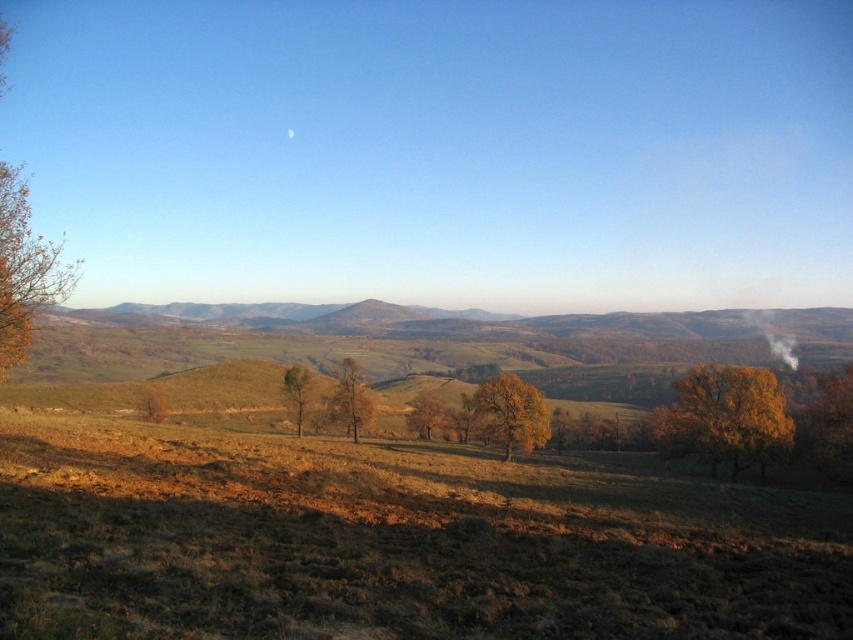
You are a farmer planning to plant crops in the brown grassland at center and the brown matte tree at center. Which area would require more space for planting, and why?

The brown grassland at center requires more space for planting because it has a larger size compared to the brown matte tree at center.

You are an artist planning to paint the rural landscape. You want to ensure the golden leafy tree at left and the brown matte tree at center are proportionally accurate. Which tree should you make wider in your painting?

The golden leafy tree at left should be made wider in the painting because it might be wider than the brown matte tree at center according to the description.

You are a hiker planning to cross the field in the image. You see the brown grassland at center and the brown matte tree at center. Which one is wider in terms of horizontal spread?

The brown grassland at center has a larger width than the brown matte tree at center according to the description.